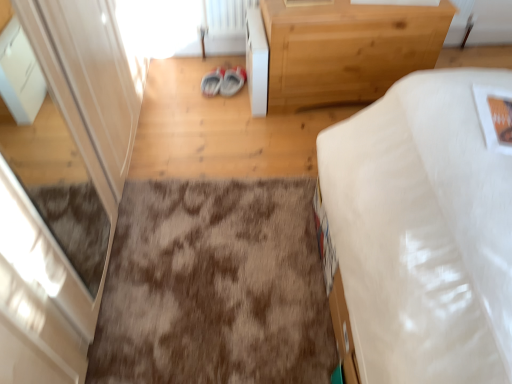
Question: Could you tell me if brown shaggy rug at center is facing white glossy screen door at left?

Choices:
 (A) no
 (B) yes

Answer: (A)

Question: Does brown shaggy rug at center have a lesser width compared to white glossy screen door at left?

Choices:
 (A) yes
 (B) no

Answer: (B)

Question: Does brown shaggy rug at center appear on the right side of white glossy screen door at left?

Choices:
 (A) no
 (B) yes

Answer: (B)

Question: From a real-world perspective, is brown shaggy rug at center physically below white glossy screen door at left?

Choices:
 (A) yes
 (B) no

Answer: (A)

Question: Is white glossy screen door at left located within brown shaggy rug at center?

Choices:
 (A) no
 (B) yes

Answer: (A)

Question: Is brown shaggy rug at center positioned beyond the bounds of white glossy screen door at left?

Choices:
 (A) no
 (B) yes

Answer: (B)

Question: Considering the relative positions of matte gray sneakers at center and brown shaggy rug at center in the image provided, is matte gray sneakers at center behind brown shaggy rug at center?

Choices:
 (A) yes
 (B) no

Answer: (A)

Question: Is matte gray sneakers at center positioned beyond the bounds of brown shaggy rug at center?

Choices:
 (A) no
 (B) yes

Answer: (B)

Question: Is matte gray sneakers at center closer to camera compared to brown shaggy rug at center?

Choices:
 (A) yes
 (B) no

Answer: (B)

Question: Is matte gray sneakers at center to the left of brown shaggy rug at center from the viewer's perspective?

Choices:
 (A) yes
 (B) no

Answer: (A)

Question: Is matte gray sneakers at center wider than brown shaggy rug at center?

Choices:
 (A) yes
 (B) no

Answer: (B)

Question: Does matte gray sneakers at center have a smaller size compared to brown shaggy rug at center?

Choices:
 (A) no
 (B) yes

Answer: (B)

Question: Considering the relative positions of matte gray sneakers at center and white glossy screen door at left in the image provided, is matte gray sneakers at center in front of white glossy screen door at left?

Choices:
 (A) no
 (B) yes

Answer: (A)